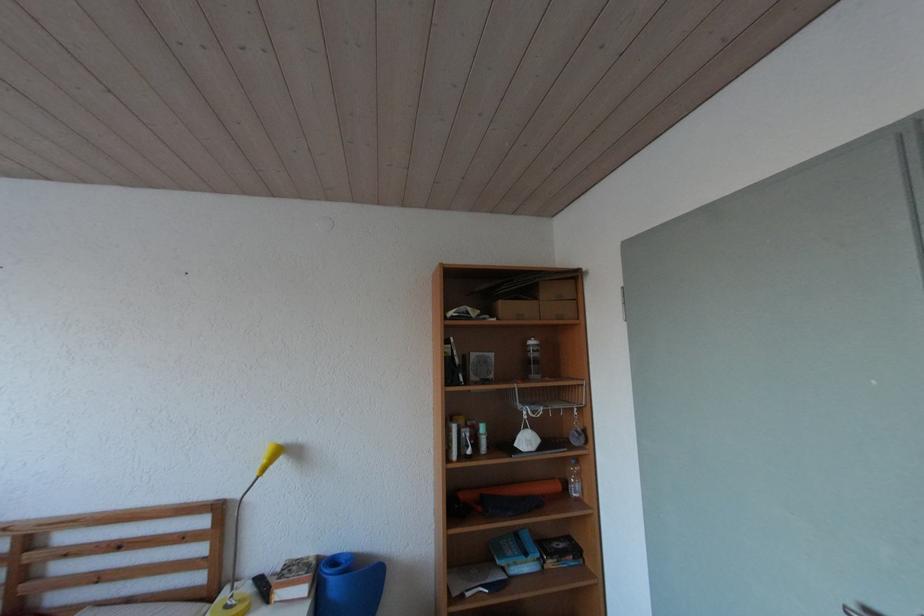
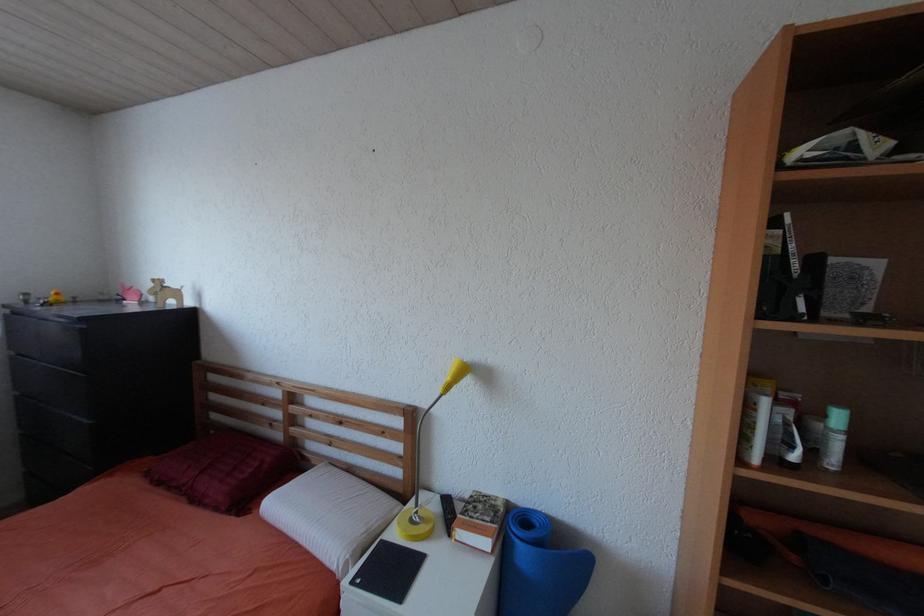
Question: The camera is either moving clockwise (left) or counter-clockwise (right) around the object. The first image is from the beginning of the video and the second image is from the end. Is the camera moving left or right when shooting the video?

Choices:
 (A) Left
 (B) Right

Answer: (B)